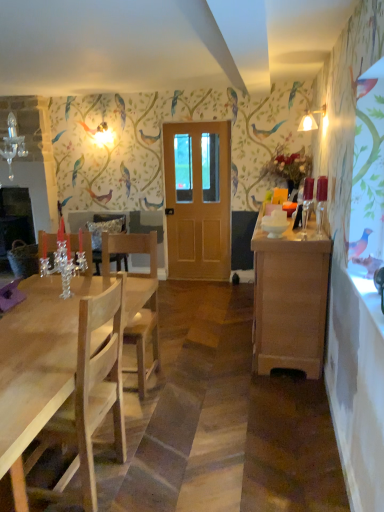
Question: From a real-world perspective, is wooden cabinet at right physically located above or below light wood chair at left, the 2th chair when ordered from back to front?

Choices:
 (A) above
 (B) below

Answer: (B)

Question: Considering the positions of point (281, 295) and point (114, 431), is point (281, 295) closer or farther from the camera than point (114, 431)?

Choices:
 (A) closer
 (B) farther

Answer: (B)

Question: Which object is positioned closest to the light wood chair at left, the 2th chair when ordered from back to front?

Choices:
 (A) matte white lampshade at upper right
 (B) wooden cabinet at right
 (C) natural wood chair at left, acting as the 1th chair starting from the back
 (D) light brown wooden door at center

Answer: (C)

Question: Which of these objects is positioned farthest from the wooden cabinet at right?

Choices:
 (A) light wood chair at left, the 2th chair when ordered from back to front
 (B) light brown wooden door at center
 (C) natural wood chair at left, placed as the 2th chair when sorted from front to back
 (D) matte white lampshade at upper right

Answer: (B)